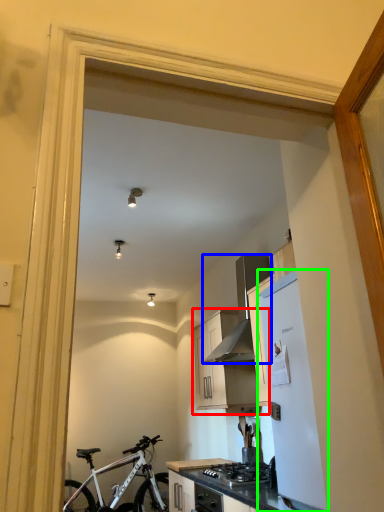
Question: Which object is positioned farthest from cabinetry (highlighted by a red box)? Select from kitchen appliance (highlighted by a blue box) and refrigerator (highlighted by a green box).

Choices:
 (A) kitchen appliance
 (B) refrigerator

Answer: (B)